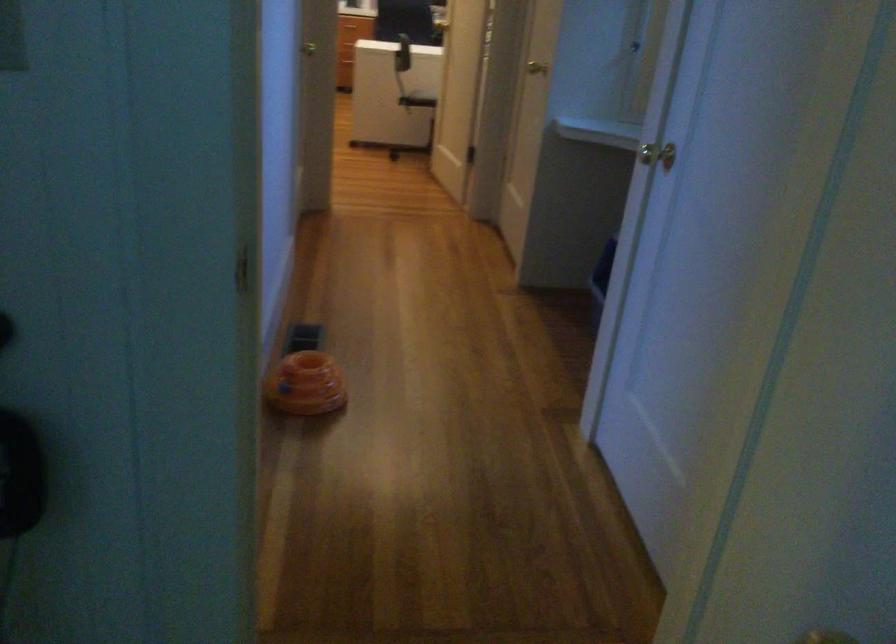
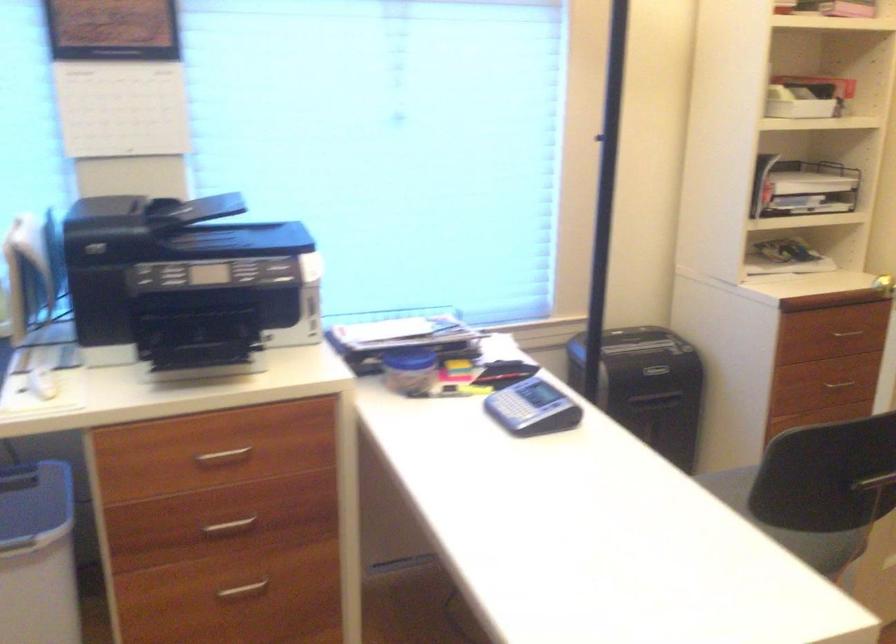
Find the pixel in the second image that matches point 423,88 in the first image.

(788, 525)